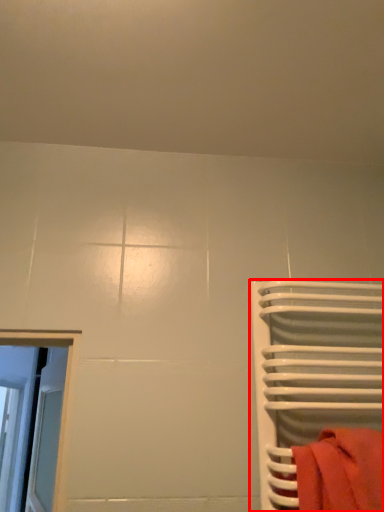
Question: From the image's perspective, where is furniture (annotated by the red box) located in relation to towel in the image?

Choices:
 (A) above
 (B) below

Answer: (A)